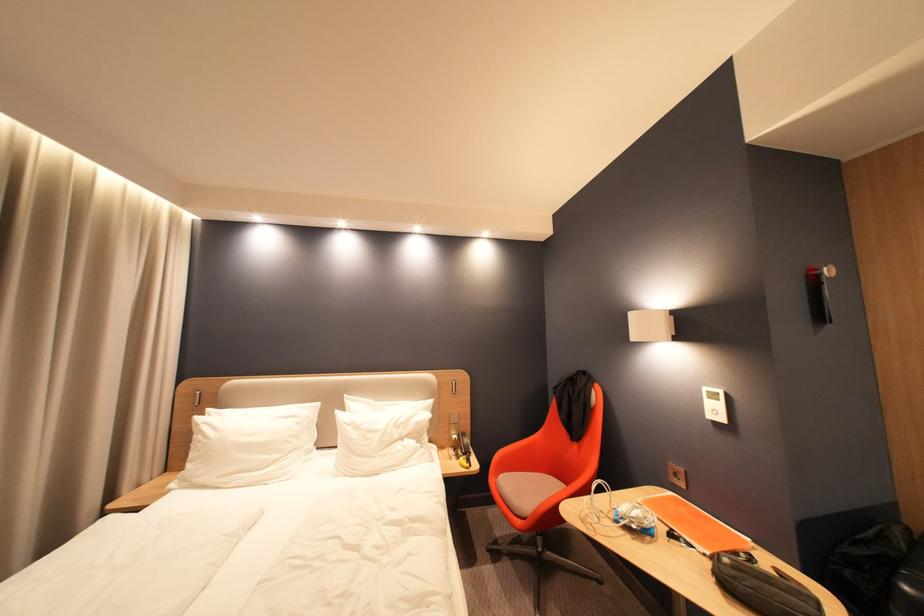
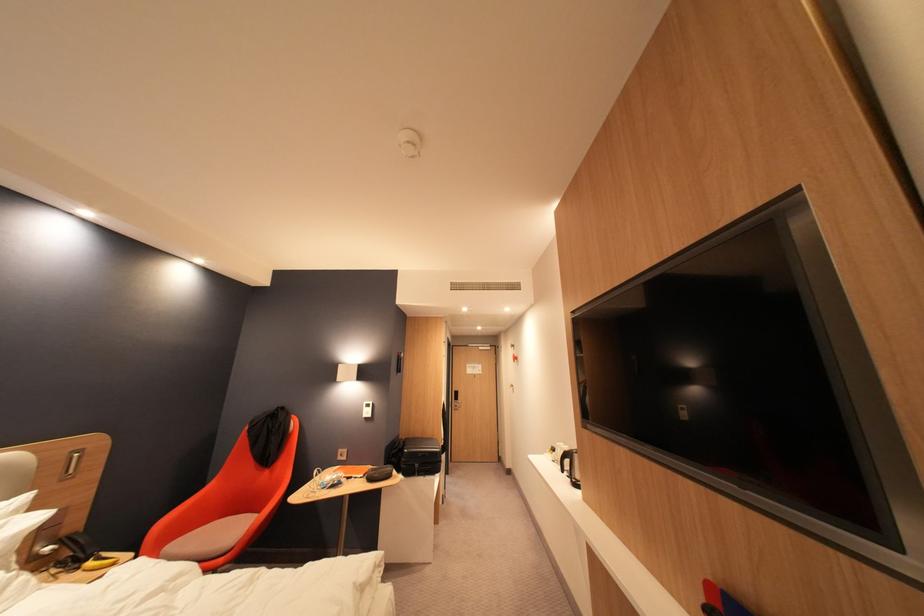
In the second image, find the point that corresponds to (714,556) in the first image.

(371, 477)